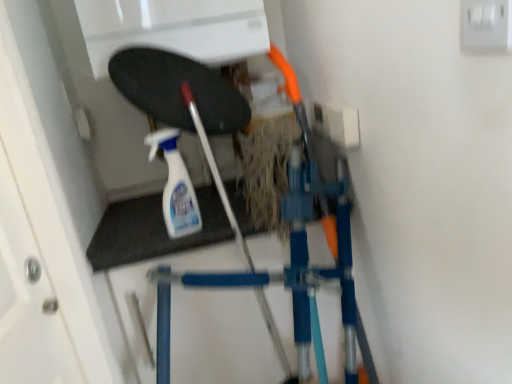
Question: Do you think white plastic switch at upper right is within clear plastic spray bottle at center, or outside of it?

Choices:
 (A) outside
 (B) inside

Answer: (A)

Question: From their relative heights in the image, would you say white plastic switch at upper right is taller or shorter than clear plastic spray bottle at center?

Choices:
 (A) short
 (B) tall

Answer: (A)

Question: Is point (498, 26) positioned closer to the camera than point (166, 150)?

Choices:
 (A) farther
 (B) closer

Answer: (B)

Question: Considering the positions of point (152, 160) and point (500, 48), is point (152, 160) closer or farther from the camera than point (500, 48)?

Choices:
 (A) farther
 (B) closer

Answer: (A)

Question: Would you say clear plastic spray bottle at center is to the left or to the right of white plastic switch at upper right in the picture?

Choices:
 (A) left
 (B) right

Answer: (A)

Question: From a real-world perspective, is clear plastic spray bottle at center positioned above or below white plastic switch at upper right?

Choices:
 (A) below
 (B) above

Answer: (A)

Question: In terms of width, does clear plastic spray bottle at center look wider or thinner when compared to white plastic switch at upper right?

Choices:
 (A) wide
 (B) thin

Answer: (A)